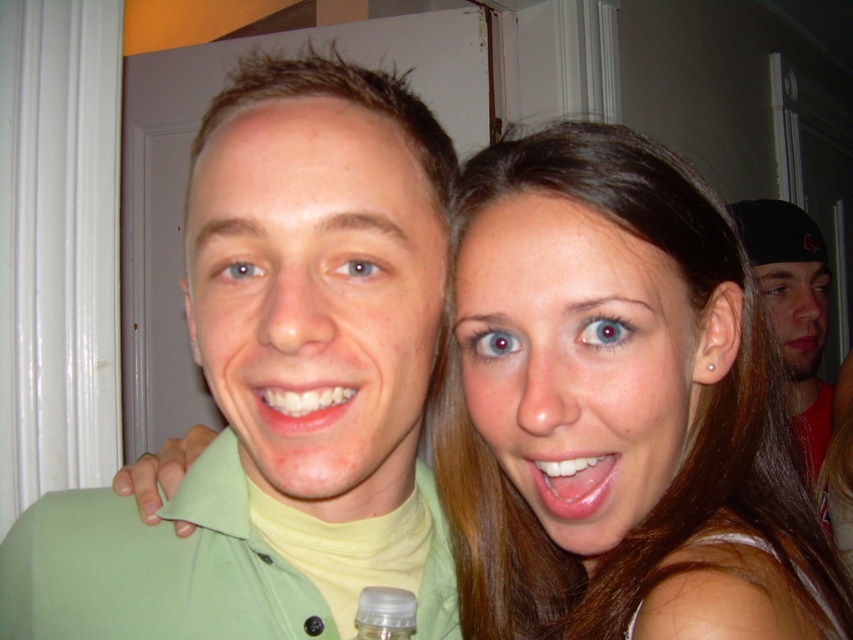
Between smooth skin face at center and green matte shirt at center, which one appears on the left side from the viewer's perspective?

green matte shirt at center

Is smooth skin face at center to the left of green matte shirt at center from the viewer's perspective?

In fact, smooth skin face at center is to the right of green matte shirt at center.

Looking at this image, who is more distant from viewer, (538, 628) or (270, 349)?

The point (538, 628) is more distant.

Find the location of a particular element. smooth skin face at center is located at coordinates (619, 406).

Looking at this image, is smooth skin face at center below white glossy teeth at center?

Indeed, smooth skin face at center is positioned under white glossy teeth at center.

Between smooth skin face at center and white glossy teeth at center, which one is positioned higher?

white glossy teeth at center is above.

Is point (689, 522) positioned behind point (262, 406)?

Yes, point (689, 522) is farther from viewer.

Find the location of a particular element. This screenshot has width=853, height=640. smooth skin face at center is located at coordinates (619, 406).

Looking at this image, does black matte cap at right have a greater height compared to glossy white teeth at center?

Yes, black matte cap at right is taller than glossy white teeth at center.

Can you confirm if black matte cap at right is positioned above glossy white teeth at center?

Yes, black matte cap at right is above glossy white teeth at center.

Is point (799, 220) farther from viewer compared to point (572, 492)?

Yes.

Identify the location of black matte cap at right. The width and height of the screenshot is (853, 640). (792, 307).